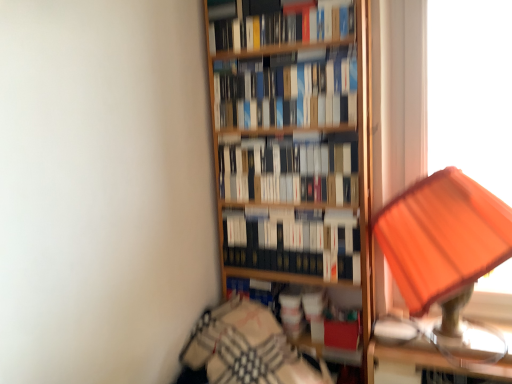
Question: Considering their positions, is hardcover books at center, which is the second book in top-to-bottom order, located in front of or behind hardcover books at center, which ranks as the first book in bottom-to-top order?

Choices:
 (A) front
 (B) behind

Answer: (A)

Question: Based on their sizes in the image, would you say hardcover books at center, which is the second book in top-to-bottom order, is bigger or smaller than hardcover books at center, marked as the fourth book in a top-to-bottom arrangement?

Choices:
 (A) small
 (B) big

Answer: (B)

Question: Which object is positioned closest to the hardcover books at center, which ranks as the first book in bottom-to-top order?

Choices:
 (A) orange fabric lampshade at right
 (B) metallic gold table at right
 (C) hardcover books at upper center, which is the 1th book from top to bottom
 (D) patterned fabric at lower left
 (E) hardcover books at center, which appears as the 2th book when ordered from the bottom

Answer: (E)

Question: Which object is positioned farthest from the hardcover books at center, which is counted as the 3th book, starting from the bottom?

Choices:
 (A) hardcover books at upper center, which is the 1th book from top to bottom
 (B) patterned fabric at lower left
 (C) hardcover books at center, which ranks as the first book in bottom-to-top order
 (D) metallic gold table at right
 (E) orange fabric lampshade at right

Answer: (D)